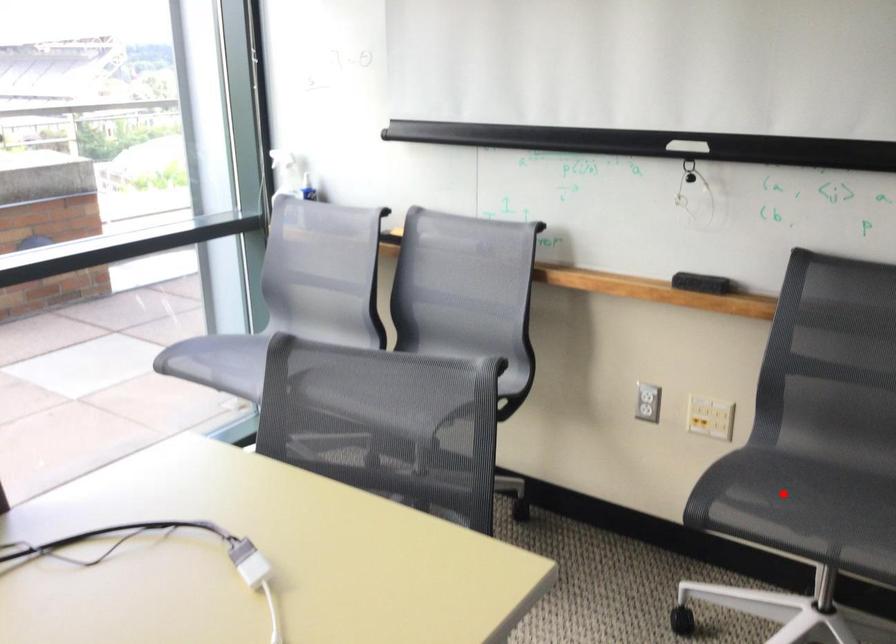
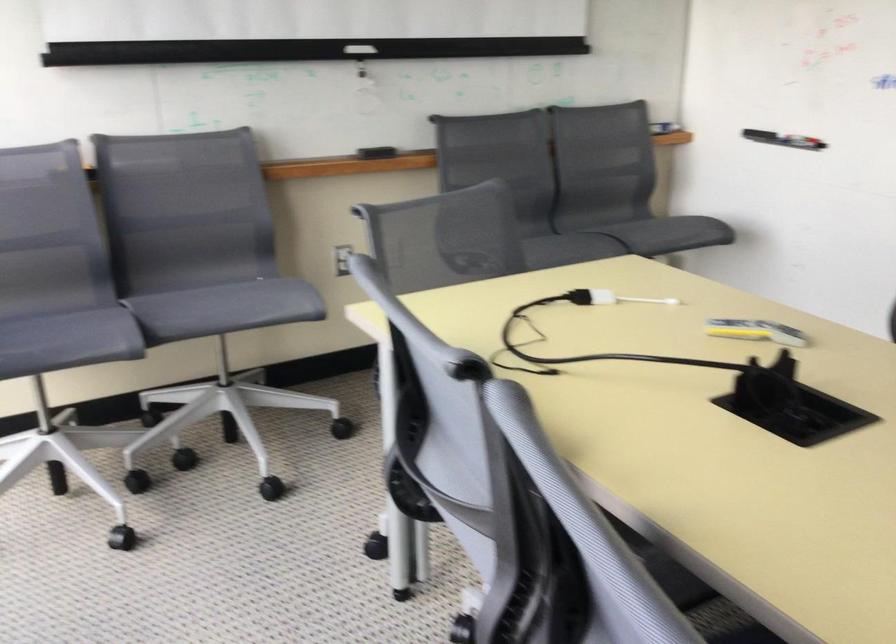
Question: I am providing you with two images of the same scene from different viewpoints. A red point is marked on the first image. At the location where the point appears in image 1, is it still visible in image 2?

Choices:
 (A) Yes
 (B) No

Answer: (B)